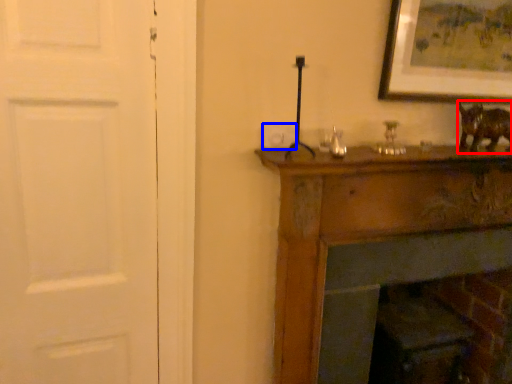
Question: Which point is further to the camera, animal (highlighted by a red box) or light switch (highlighted by a blue box)?

Choices:
 (A) animal
 (B) light switch

Answer: (A)